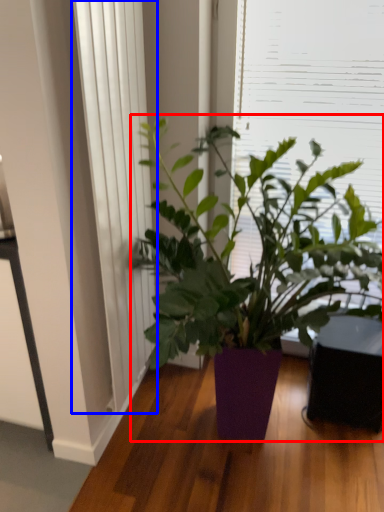
Question: Which object is closer to the camera taking this photo, houseplant (highlighted by a red box) or curtain (highlighted by a blue box)?

Choices:
 (A) houseplant
 (B) curtain

Answer: (A)